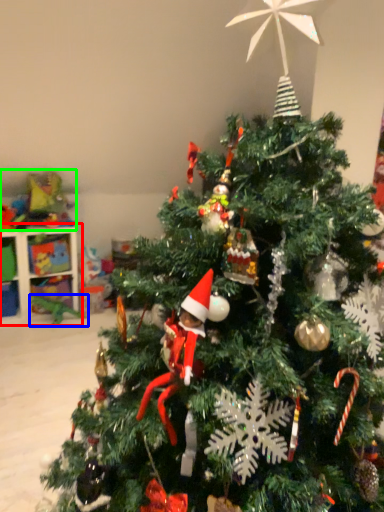
Question: Estimate the real-world distances between objects in this image. Which object is farther from shelf (highlighted by a red box), toy (highlighted by a blue box) or toy (highlighted by a green box)?

Choices:
 (A) toy
 (B) toy

Answer: (A)